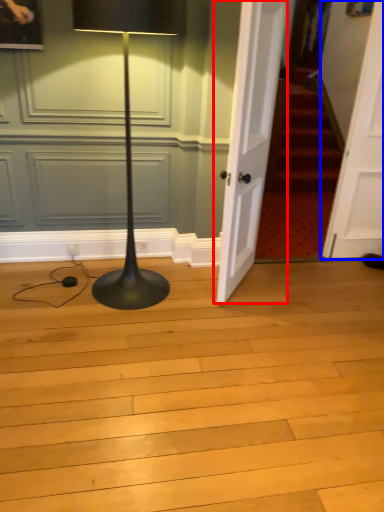
Question: Which object is closer to the camera taking this photo, door (highlighted by a red box) or door (highlighted by a blue box)?

Choices:
 (A) door
 (B) door

Answer: (A)